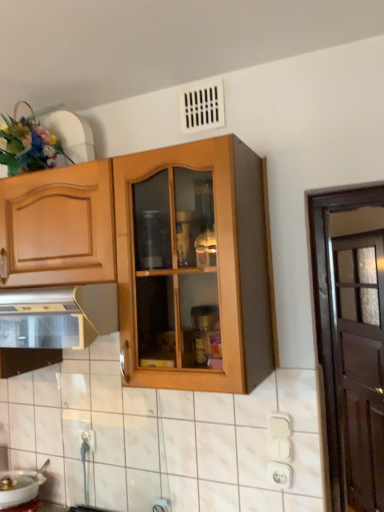
Question: Considering the relative sizes of metallic stainless steel oven at lower left and white glossy sink at lower left in the image provided, is metallic stainless steel oven at lower left smaller than white glossy sink at lower left?

Choices:
 (A) yes
 (B) no

Answer: (B)

Question: Is metallic stainless steel oven at lower left far from white glossy sink at lower left?

Choices:
 (A) yes
 (B) no

Answer: (B)

Question: Can white glossy sink at lower left be found inside metallic stainless steel oven at lower left?

Choices:
 (A) yes
 (B) no

Answer: (B)

Question: From a real-world perspective, is metallic stainless steel oven at lower left under white glossy sink at lower left?

Choices:
 (A) no
 (B) yes

Answer: (A)

Question: From the image's perspective, does metallic stainless steel oven at lower left appear lower than white glossy sink at lower left?

Choices:
 (A) yes
 (B) no

Answer: (B)

Question: Is point (18, 136) closer or farther from the camera than point (278, 464)?

Choices:
 (A) farther
 (B) closer

Answer: (A)

Question: In the image, is fluffy floral bouquet at upper left on the left side or the right side of white plastic electric outlet at lower right, which ranks as the first electric outlet in right-to-left order?

Choices:
 (A) left
 (B) right

Answer: (A)

Question: Considering the positions of fluffy floral bouquet at upper left and white plastic electric outlet at lower right, the second electric outlet in the back-to-front sequence, in the image, is fluffy floral bouquet at upper left wider or thinner than white plastic electric outlet at lower right, the second electric outlet in the back-to-front sequence,?

Choices:
 (A) wide
 (B) thin

Answer: (A)

Question: From the image's perspective, relative to white plastic electric outlet at lower right, marked as the second electric outlet in a left-to-right arrangement, is fluffy floral bouquet at upper left above or below?

Choices:
 (A) above
 (B) below

Answer: (A)

Question: Looking at their shapes, would you say white glossy sink at lower left is wider or thinner than white plastic electric outlet at lower center, the second electric outlet when ordered from front to back?

Choices:
 (A) thin
 (B) wide

Answer: (B)

Question: Relative to white plastic electric outlet at lower center, the second electric outlet from the right, is white glossy sink at lower left in front or behind?

Choices:
 (A) front
 (B) behind

Answer: (A)

Question: From the image's perspective, is white glossy sink at lower left located above or below white plastic electric outlet at lower center, the second electric outlet from the right?

Choices:
 (A) above
 (B) below

Answer: (B)

Question: From a real-world perspective, is white glossy sink at lower left physically located above or below white plastic electric outlet at lower center, the second electric outlet from the right?

Choices:
 (A) above
 (B) below

Answer: (B)

Question: Is brown wooden door at right in front of or behind fluffy floral bouquet at upper left in the image?

Choices:
 (A) front
 (B) behind

Answer: (B)

Question: Considering the positions of brown wooden door at right and fluffy floral bouquet at upper left in the image, is brown wooden door at right taller or shorter than fluffy floral bouquet at upper left?

Choices:
 (A) tall
 (B) short

Answer: (A)